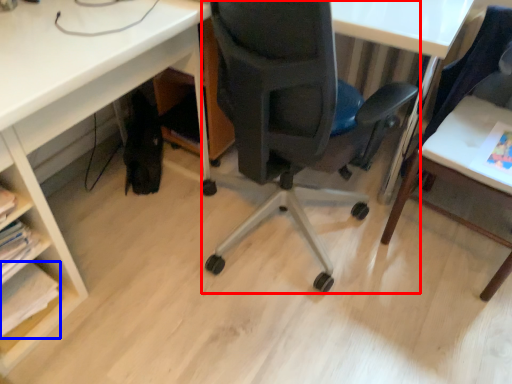
Question: Which point is closer to the camera, chair (highlighted by a red box) or book (highlighted by a blue box)?

Choices:
 (A) chair
 (B) book

Answer: (A)